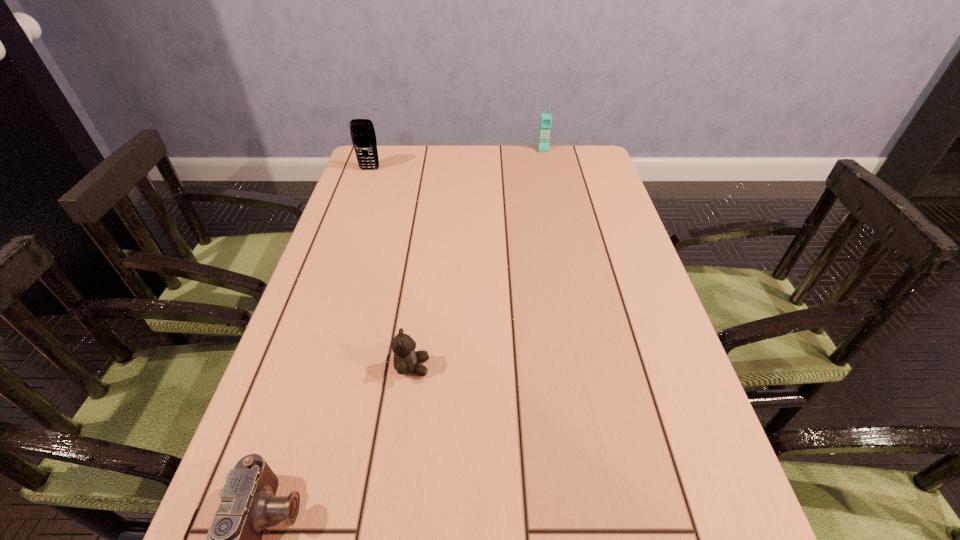
The image size is (960, 540). I want to click on object that ranks as the third closest to the farther cellular telephone, so click(x=248, y=501).

Identify the location of object that is the closest to the farther cellular telephone. (363, 136).